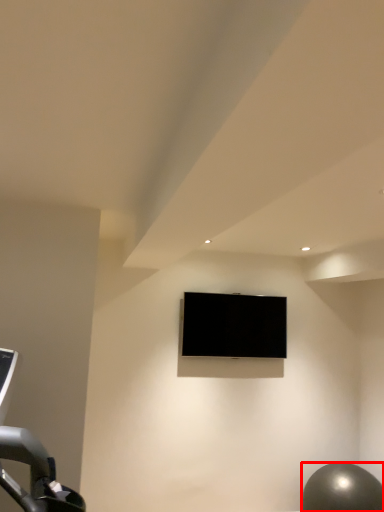
Question: Where is ball (annotated by the red box) located in relation to television in the image?

Choices:
 (A) left
 (B) right

Answer: (B)